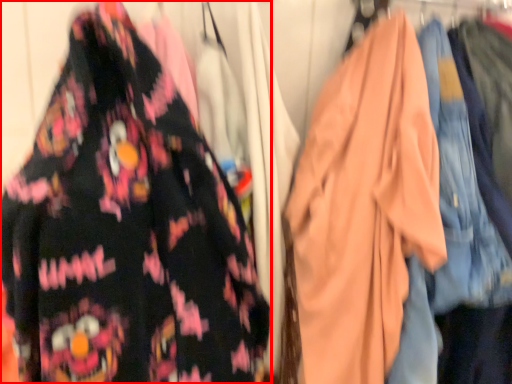
Question: From the image's perspective, where is fancy dress (annotated by the red box) located relative to garment?

Choices:
 (A) below
 (B) above

Answer: (B)